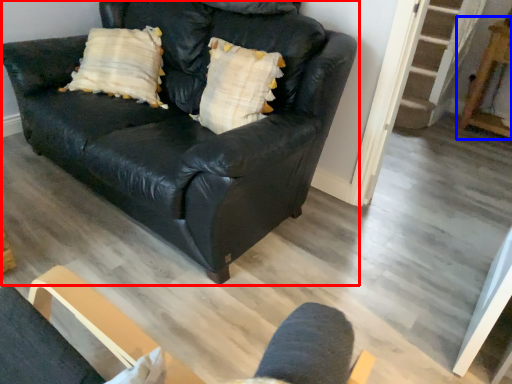
Question: Which object is further to the camera taking this photo, studio couch (highlighted by a red box) or table (highlighted by a blue box)?

Choices:
 (A) studio couch
 (B) table

Answer: (B)